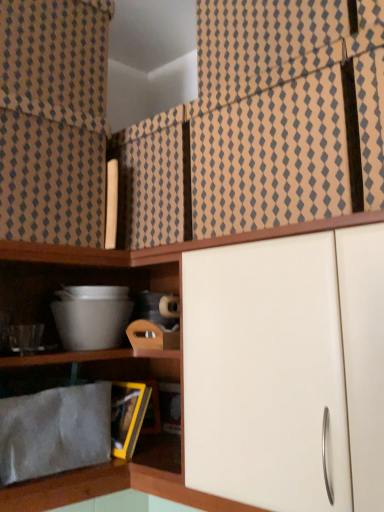
Question: Does point (206, 67) appear closer or farther from the camera than point (175, 465)?

Choices:
 (A) farther
 (B) closer

Answer: (A)

Question: In terms of size, does brown textured fabric at upper center, which ranks as the 1th curtain in right-to-left order, appear bigger or smaller than gray fabric at lower left?

Choices:
 (A) small
 (B) big

Answer: (B)

Question: Which object is the farthest from the gray fabric at lower left?

Choices:
 (A) beige textured curtain at upper left, arranged as the 2th curtain when viewed from the right
 (B) brown textured fabric at upper center, which ranks as the 1th curtain in right-to-left order

Answer: (B)

Question: Which object is positioned closest to the gray fabric at lower left?

Choices:
 (A) brown textured fabric at upper center, which ranks as the 1th curtain in right-to-left order
 (B) beige textured curtain at upper left, arranged as the 2th curtain when viewed from the right

Answer: (B)